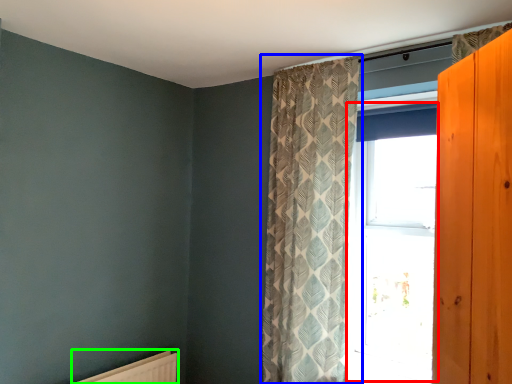
Question: Which object is the farthest from window (highlighted by a red box)? Choose among these: curtain (highlighted by a blue box) or radiator (highlighted by a green box).

Choices:
 (A) curtain
 (B) radiator

Answer: (B)